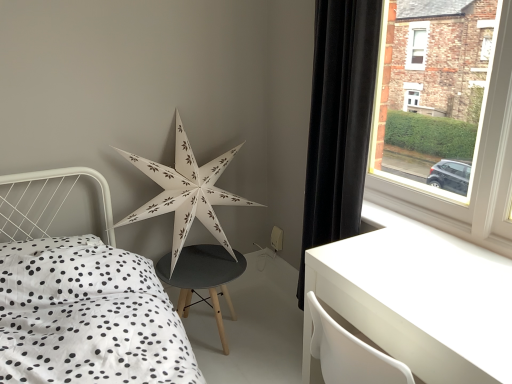
Question: From the image's perspective, is white paper star at center located above or below white glossy table at lower right?

Choices:
 (A) below
 (B) above

Answer: (B)

Question: Does point (178, 150) appear closer or farther from the camera than point (501, 345)?

Choices:
 (A) closer
 (B) farther

Answer: (B)

Question: Based on their relative distances, which object is farther from the white glossy table at lower right?

Choices:
 (A) white smooth window sill at lower right
 (B) black velvet curtain at right
 (C) white paper star at center

Answer: (C)

Question: Which object is the farthest from the white smooth window sill at lower right?

Choices:
 (A) white paper star at center
 (B) white glossy table at lower right
 (C) black velvet curtain at right

Answer: (A)